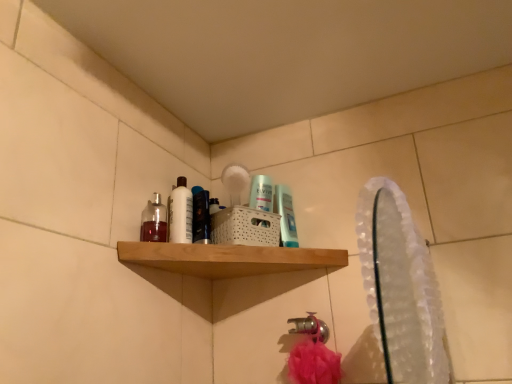
Question: Is clear plastic mirror at upper right located outside translucent plastic mouthwash at center, the 2th mouthwash positioned from the right?

Choices:
 (A) yes
 (B) no

Answer: (A)

Question: From a real-world perspective, is clear plastic mirror at upper right physically below translucent plastic mouthwash at center, the 2th mouthwash positioned from the right?

Choices:
 (A) no
 (B) yes

Answer: (B)

Question: Would you say translucent plastic mouthwash at center, which ranks as the 2th mouthwash in left-to-right order, is part of clear plastic mirror at upper right's contents?

Choices:
 (A) no
 (B) yes

Answer: (A)

Question: From a real-world perspective, is clear plastic mirror at upper right physically above translucent plastic mouthwash at center, which ranks as the 2th mouthwash in left-to-right order?

Choices:
 (A) no
 (B) yes

Answer: (A)

Question: Is clear plastic mirror at upper right shorter than translucent plastic mouthwash at center, which ranks as the 2th mouthwash in left-to-right order?

Choices:
 (A) yes
 (B) no

Answer: (B)

Question: In terms of width, does translucent plastic mouthwash at upper center, acting as the first mouthwash starting from the right, look wider or thinner when compared to translucent plastic mouthwash at center, which ranks as the 2th mouthwash in left-to-right order?

Choices:
 (A) thin
 (B) wide

Answer: (A)

Question: In the image, is translucent plastic mouthwash at upper center, which ranks as the 3th mouthwash in left-to-right order, on the left side or the right side of translucent plastic mouthwash at center, which ranks as the 2th mouthwash in left-to-right order?

Choices:
 (A) left
 (B) right

Answer: (B)

Question: Considering the positions of translucent plastic mouthwash at upper center, which ranks as the 3th mouthwash in left-to-right order, and translucent plastic mouthwash at center, the 2th mouthwash positioned from the right, in the image, is translucent plastic mouthwash at upper center, which ranks as the 3th mouthwash in left-to-right order, taller or shorter than translucent plastic mouthwash at center, the 2th mouthwash positioned from the right,?

Choices:
 (A) tall
 (B) short

Answer: (B)

Question: In terms of size, does translucent plastic mouthwash at upper center, which ranks as the 3th mouthwash in left-to-right order, appear bigger or smaller than translucent plastic mouthwash at center, which ranks as the 2th mouthwash in left-to-right order?

Choices:
 (A) small
 (B) big

Answer: (A)

Question: Considering the positions of translucent glass bottle at upper left, which ranks as the 1th mouthwash in left-to-right order, and clear plastic mirror at upper right in the image, is translucent glass bottle at upper left, which ranks as the 1th mouthwash in left-to-right order, taller or shorter than clear plastic mirror at upper right?

Choices:
 (A) tall
 (B) short

Answer: (B)

Question: Considering the positions of point (157, 235) and point (387, 372), is point (157, 235) closer or farther from the camera than point (387, 372)?

Choices:
 (A) farther
 (B) closer

Answer: (A)

Question: Is translucent glass bottle at upper left, which is the third mouthwash in right-to-left order, spatially inside clear plastic mirror at upper right, or outside of it?

Choices:
 (A) inside
 (B) outside

Answer: (B)

Question: In the image, is translucent glass bottle at upper left, which ranks as the 1th mouthwash in left-to-right order, on the left side or the right side of clear plastic mirror at upper right?

Choices:
 (A) left
 (B) right

Answer: (A)

Question: Is translucent plastic mouthwash at center, the 2th mouthwash positioned from the right, taller or shorter than translucent plastic mouthwash at upper center, acting as the first mouthwash starting from the right?

Choices:
 (A) tall
 (B) short

Answer: (A)

Question: Is translucent plastic mouthwash at center, which ranks as the 2th mouthwash in left-to-right order, situated inside translucent plastic mouthwash at upper center, acting as the first mouthwash starting from the right, or outside?

Choices:
 (A) outside
 (B) inside

Answer: (A)